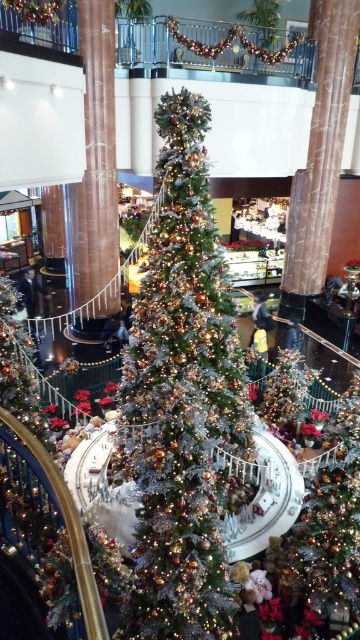
Is shiny silver christmas tree at center to the right of brown marble pillar at center from the viewer's perspective?

Yes, shiny silver christmas tree at center is to the right of brown marble pillar at center.

Who is lower down, shiny silver christmas tree at center or brown marble pillar at center?

shiny silver christmas tree at center is below.

Identify the location of shiny silver christmas tree at center. (182, 400).

You are a GUI agent. You are given a task and a screenshot of the screen. Output one action in this format:
    pyautogui.click(x=<x>, y=<y>)
    Task: Click on the shiny silver christmas tree at center
    
    Given the screenshot: What is the action you would take?
    pyautogui.click(x=182, y=400)